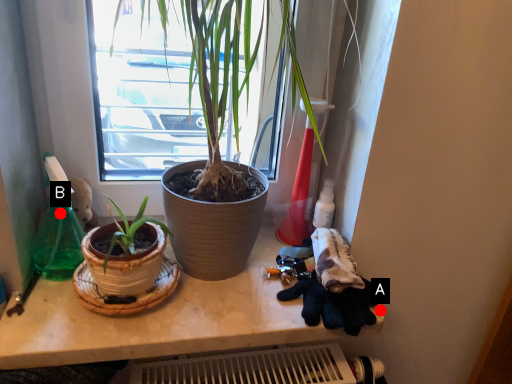
Question: Two points are circled on the image, labeled by A and B beside each circle. Which point is closer to the camera?

Choices:
 (A) A is closer
 (B) B is closer

Answer: (A)